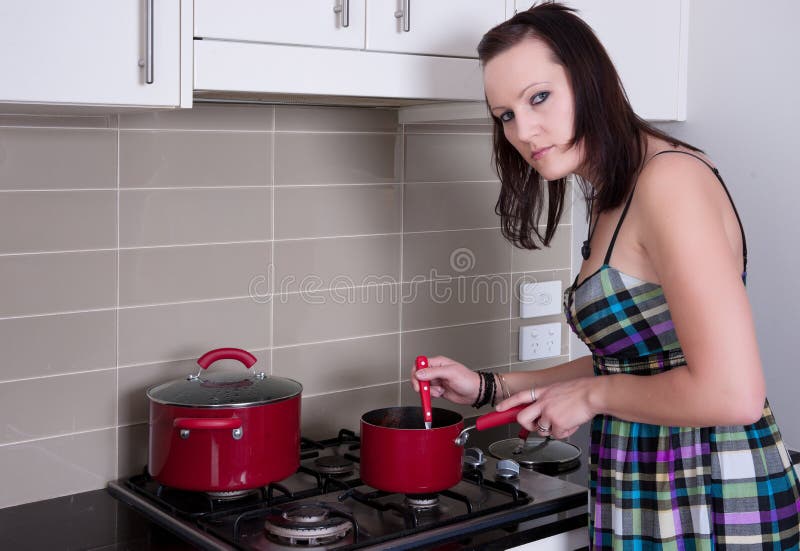
Locate an element on the screen. The width and height of the screenshot is (800, 551). pot lid is located at coordinates (544, 452).